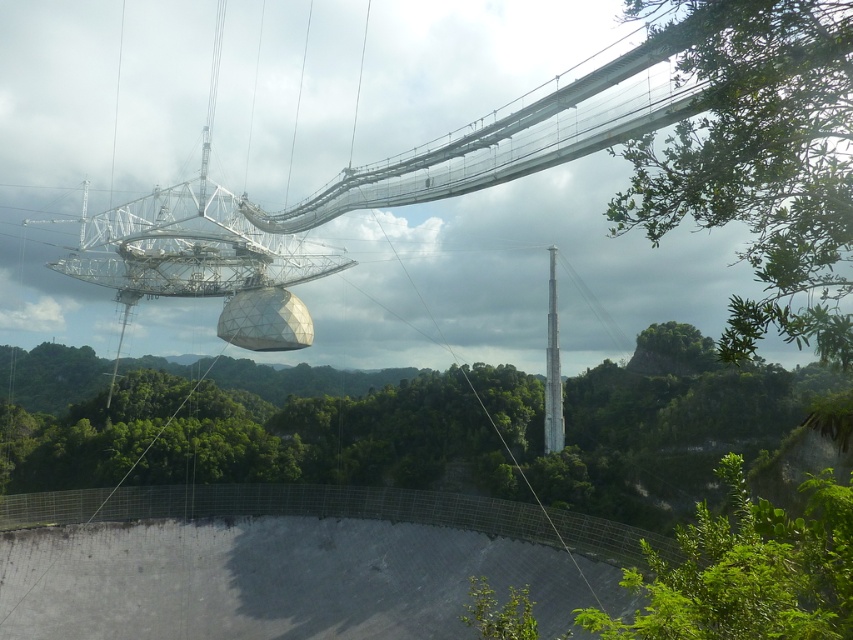
Question: Which point is closer to the camera taking this photo?

Choices:
 (A) (x=778, y=276)
 (B) (x=553, y=448)

Answer: (A)

Question: Which point appears closest to the camera in this image?

Choices:
 (A) (611, 381)
 (B) (799, 12)
 (C) (631, 637)
 (D) (544, 372)

Answer: (C)

Question: Is green leafy tree at center positioned before smooth gray pole at center?

Choices:
 (A) no
 (B) yes

Answer: (B)

Question: Estimate the real-world distances between objects in this image. Which object is closer to the green leafy tree at center?

Choices:
 (A) green leafy tree at upper right
 (B) smooth gray pole at center

Answer: (B)

Question: Can you confirm if green leafy tree at center is wider than smooth gray pole at center?

Choices:
 (A) yes
 (B) no

Answer: (A)

Question: Is green leafy tree at center to the right of smooth gray pole at center from the viewer's perspective?

Choices:
 (A) yes
 (B) no

Answer: (B)